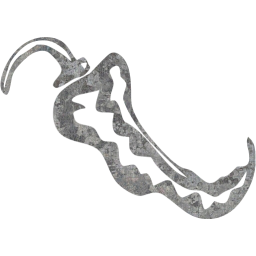
Where is `light reflections`? This screenshot has width=256, height=256. light reflections is located at coordinates (95, 120), (225, 198), (121, 85).